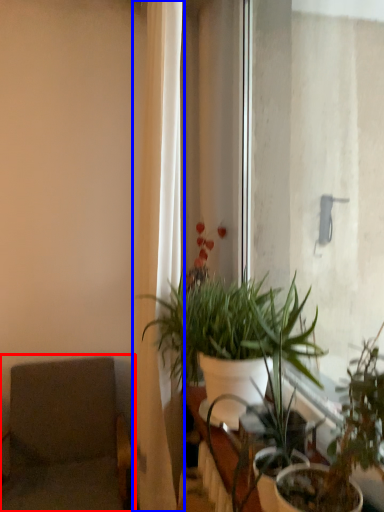
Question: Which object is further to the camera taking this photo, swivel chair (highlighted by a red box) or curtain (highlighted by a blue box)?

Choices:
 (A) swivel chair
 (B) curtain

Answer: (A)